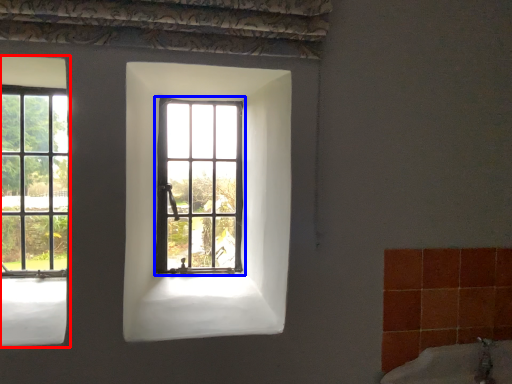
Question: Which object is further to the camera taking this photo, window (highlighted by a red box) or window (highlighted by a blue box)?

Choices:
 (A) window
 (B) window

Answer: (B)